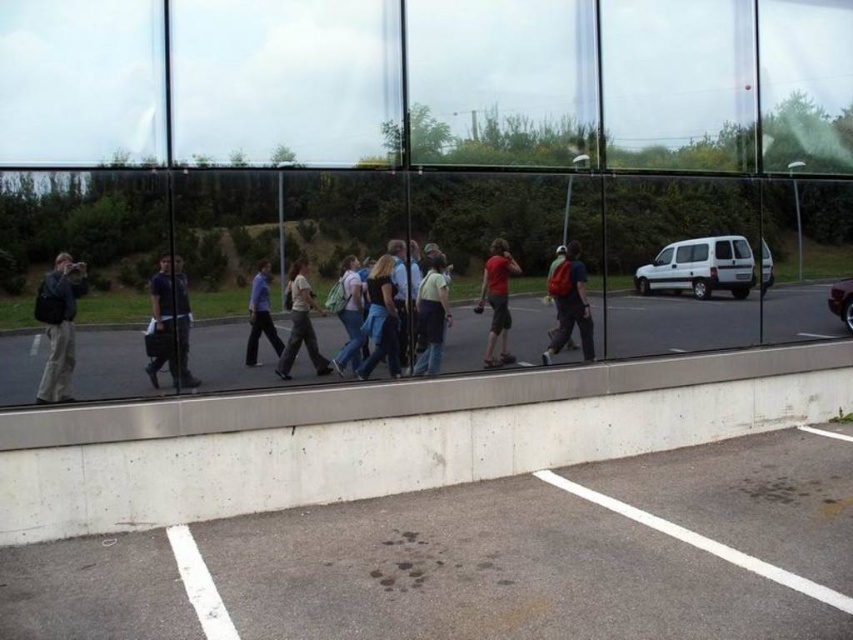
Question: Can you confirm if dark blue shirt at center is thinner than light brown fabric pants at center?

Choices:
 (A) no
 (B) yes

Answer: (B)

Question: Which object appears closest to the camera in this image?

Choices:
 (A) light blue denim jeans at center
 (B) light brown fabric pants at center
 (C) matte red shirt at center

Answer: (B)

Question: Which of the following is the closest to the observer?

Choices:
 (A) matte black backpack at left
 (B) light brown fabric pants at center
 (C) matte red backpack at center

Answer: (A)

Question: Which object is closer to the camera taking this photo?

Choices:
 (A) light blue shirt at center
 (B) shiny metallic car at right

Answer: (A)

Question: Is matte black backpack at left thinner than light blue denim jeans at center?

Choices:
 (A) yes
 (B) no

Answer: (B)

Question: Can you confirm if light blue shirt at center is positioned to the left of shiny metallic car at right?

Choices:
 (A) yes
 (B) no

Answer: (A)